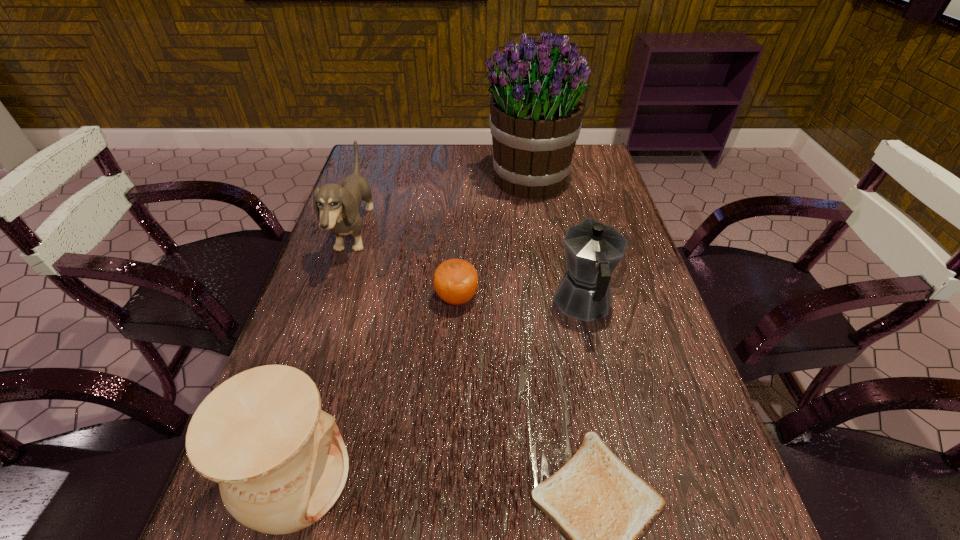
Identify the location of blank space at the far right corner. The height and width of the screenshot is (540, 960). (605, 183).

Image resolution: width=960 pixels, height=540 pixels. I want to click on vacant area between the bouquet and the coffeepot, so click(556, 241).

You are a GUI agent. You are given a task and a screenshot of the screen. Output one action in this format:
    pyautogui.click(x=<x>, y=<y>)
    Task: Click on the vacant space in between the bouquet and the puppy
    The image size is (960, 540).
    Given the screenshot: What is the action you would take?
    pyautogui.click(x=442, y=206)

Where is `unoccupied position between the bouquet and the puppy`? unoccupied position between the bouquet and the puppy is located at coordinates (442, 206).

This screenshot has width=960, height=540. I want to click on empty space between the orange and the coffeepot, so [520, 300].

Find the location of `vacant area between the orange and the tallest object`. vacant area between the orange and the tallest object is located at coordinates (492, 239).

At what (x,y) coordinates should I click in order to perform the action: click on object that is the fourth closest to the pottery. Please return your answer as a coordinate pair (x, y). The width and height of the screenshot is (960, 540). Looking at the image, I should click on (593, 250).

Identify which object is the second nearest to the puppy. Please provide its 2D coordinates. Your answer should be formatted as a tuple, i.e. [(x, y)], where the tuple contains the x and y coordinates of a point satisfying the conditions above.

[(536, 109)]

Find the location of a particular element. This screenshot has height=540, width=960. free point that satisfies the following two spatial constraints: 1. at the face of the orange; 2. on the right side of the puppy is located at coordinates (333, 298).

Where is `free space that satisfies the following two spatial constraints: 1. at the face of the puppy; 2. at the spout of the coffeepot`? The image size is (960, 540). free space that satisfies the following two spatial constraints: 1. at the face of the puppy; 2. at the spout of the coffeepot is located at coordinates (331, 302).